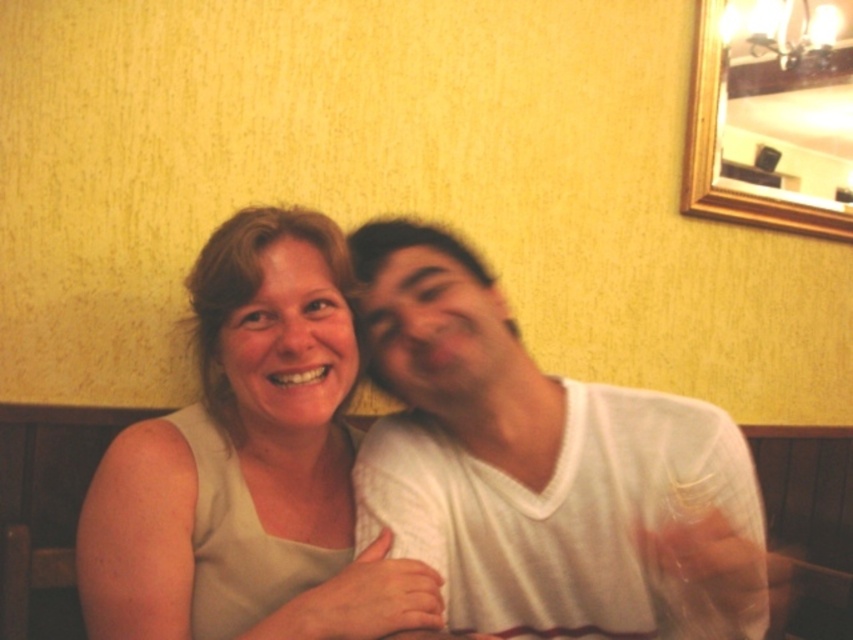
Question: Is white cotton shirt at center thinner than matte beige blouse at center?

Choices:
 (A) yes
 (B) no

Answer: (B)

Question: Estimate the real-world distances between objects in this image. Which object is farther from the white cotton shirt at center?

Choices:
 (A) gold wooden picture frame at upper right
 (B) matte beige blouse at center

Answer: (A)

Question: Can you confirm if matte beige blouse at center is positioned below gold wooden picture frame at upper right?

Choices:
 (A) yes
 (B) no

Answer: (A)

Question: Estimate the real-world distances between objects in this image. Which object is farther from the white cotton shirt at center?

Choices:
 (A) gold wooden picture frame at upper right
 (B) matte beige blouse at center

Answer: (A)

Question: Based on their relative distances, which object is nearer to the matte beige blouse at center?

Choices:
 (A) white cotton shirt at center
 (B) gold wooden picture frame at upper right

Answer: (A)

Question: Is white cotton shirt at center positioned at the back of matte beige blouse at center?

Choices:
 (A) no
 (B) yes

Answer: (A)